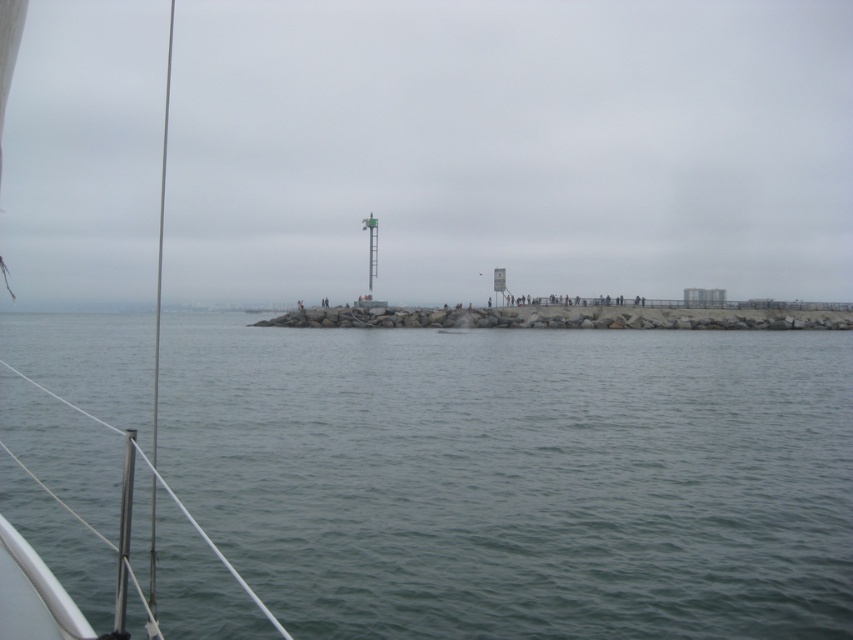
You are on a boat and want to know which object in the scene takes up more space. Based on the view from the boat deck, which is bigger between the gray matte water at center and the white matte boat at center?

The gray matte water at center is larger in size than the white matte boat at center.

You are a sailor on a boat and need to anchor in the gray matte water at center. The anchor chain can only extend 70 meters. Can you safely anchor there without the chain reaching the gray concrete pier at center?

The distance between the gray matte water at center and the gray concrete pier at center is 74.39 meters. Since the anchor chain can only extend 70 meters, it would not be safe to anchor there as the chain would not reach the pier.

You are on a boat and want to know if the gray concrete pier at center can accommodate the white matte boat at center for docking. Can the pier fit the boat based on their widths?

The gray concrete pier at center is wider than the white matte boat at center, so the pier can accommodate the boat for docking.